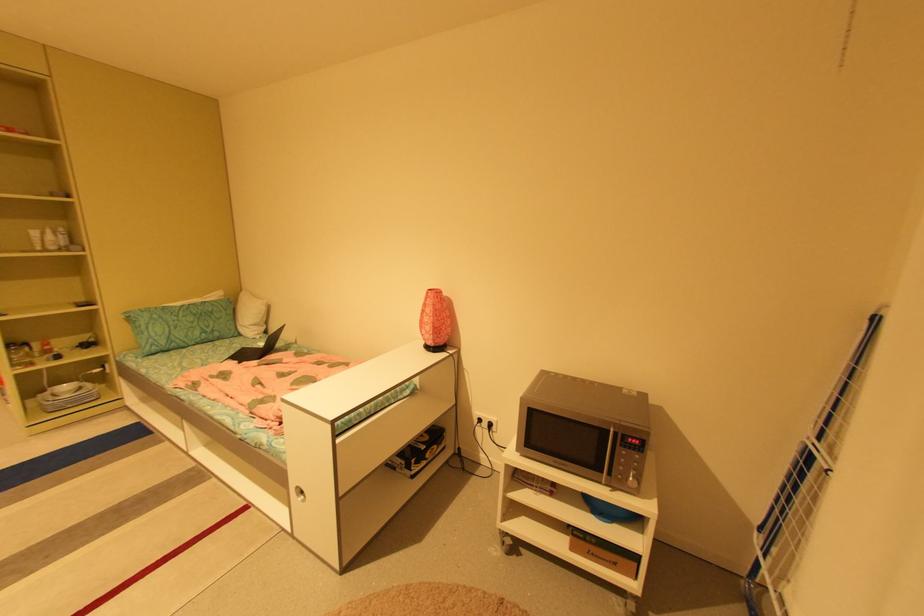
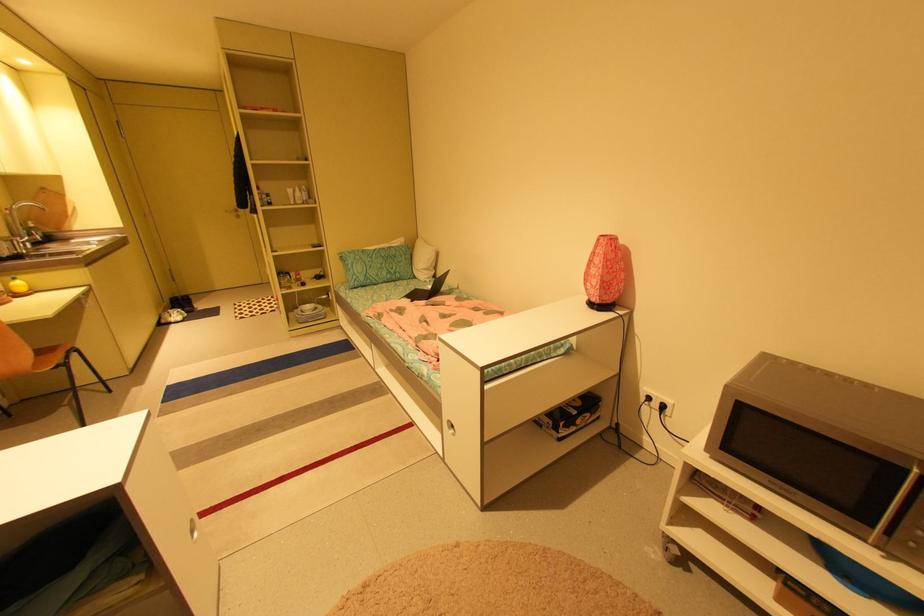
Where in the second image is the point corresponding to the point at 301,496 from the first image?

(454, 429)